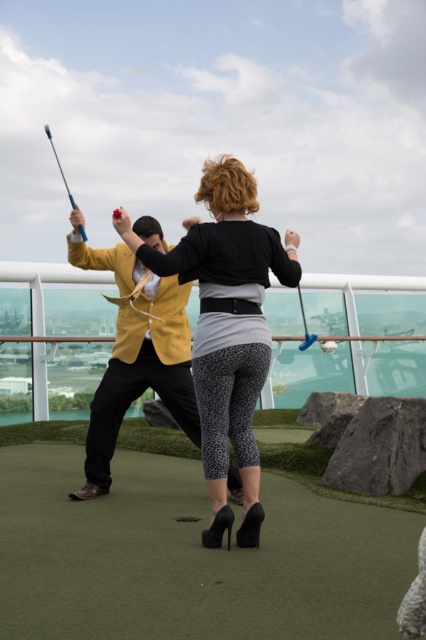
You are a fashion designer observing the image and want to create a line of sportswear. Which object in the scene, the black textured leggings at center or the blue plastic fishing pole at upper left, would you consider for inspiration based on its size?

The black textured leggings at center would be better for inspiration because its width surpasses the blue plastic fishing pole at upper left, indicating a larger surface area to work with.